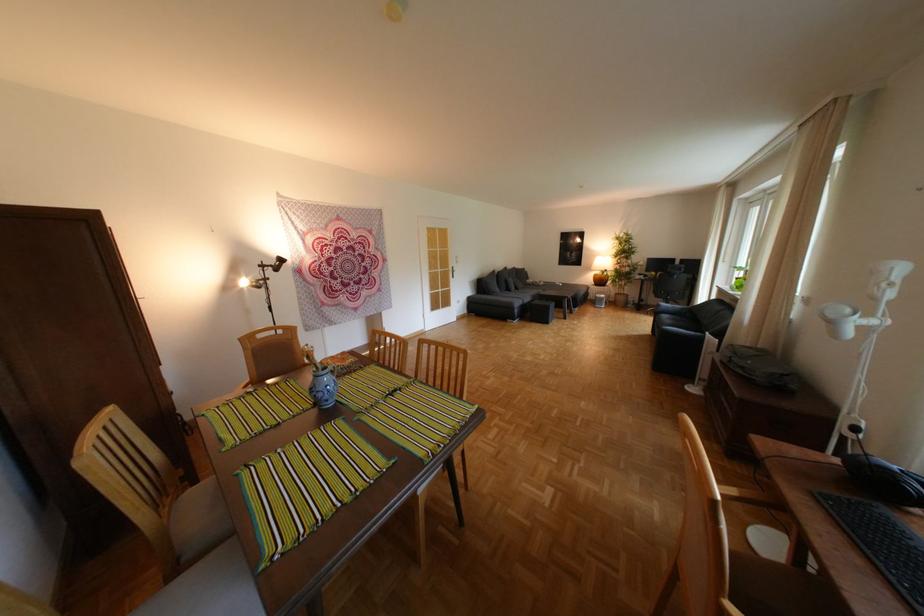
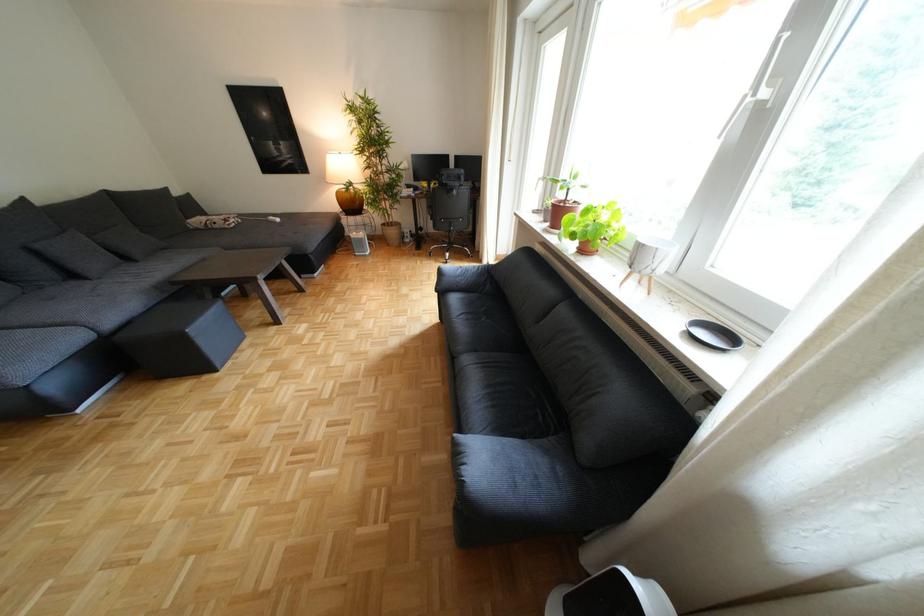
Locate, in the second image, the point that corresponds to the point at 677,317 in the first image.

(467, 299)